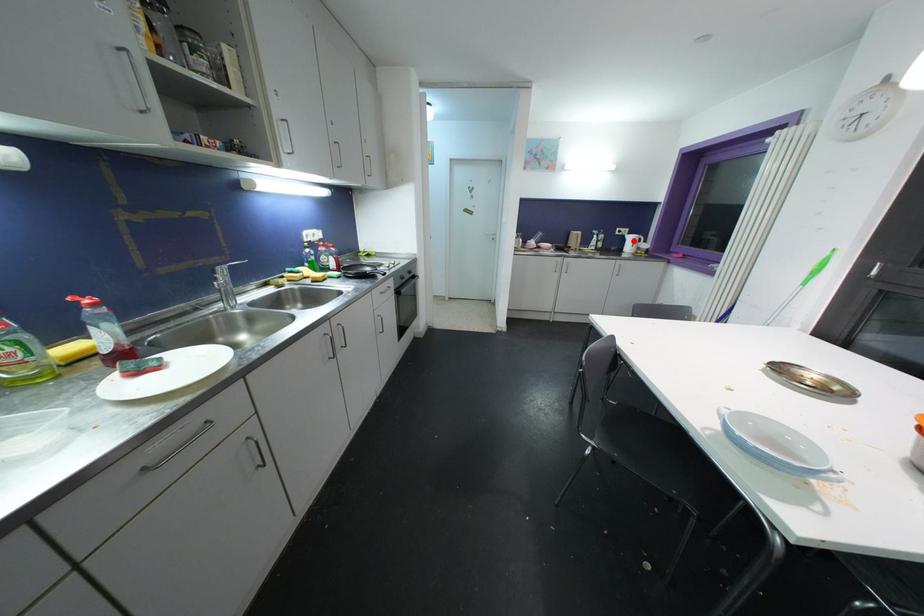
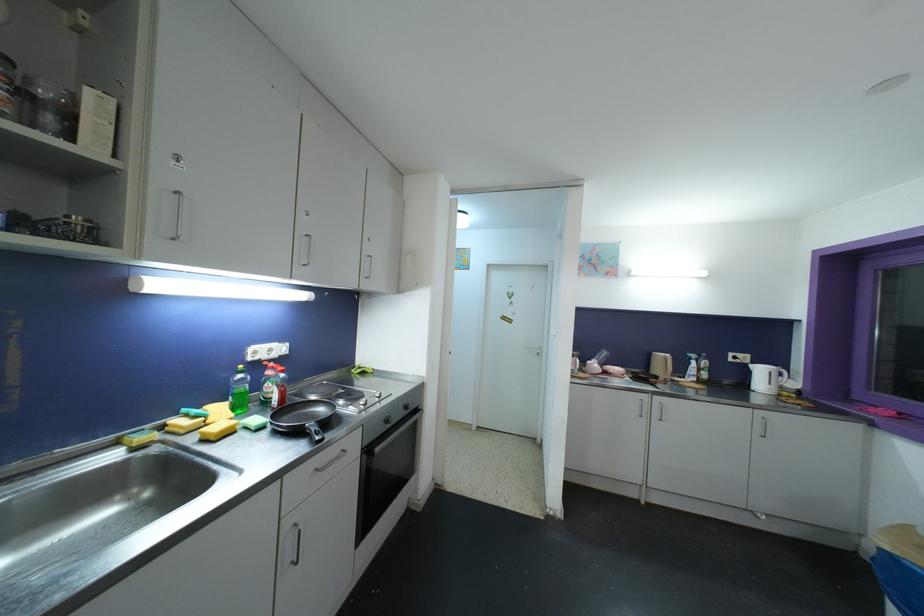
Question: I am providing you with two images of the same scene from different viewpoints. A red point is marked on the first image. Is the red point's position out of view in image 2?

Choices:
 (A) Yes
 (B) No

Answer: (B)